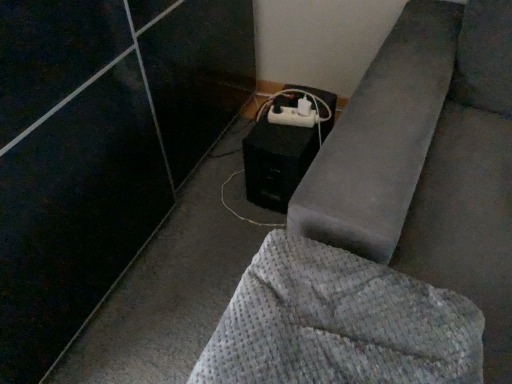
Question: Does waffle-textured gray blanket at lower right have a larger size compared to white plastic extension cord at lower center?

Choices:
 (A) no
 (B) yes

Answer: (B)

Question: From the image's perspective, is waffle-textured gray blanket at lower right under white plastic extension cord at lower center?

Choices:
 (A) yes
 (B) no

Answer: (A)

Question: Is waffle-textured gray blanket at lower right behind white plastic extension cord at lower center?

Choices:
 (A) no
 (B) yes

Answer: (A)

Question: Are waffle-textured gray blanket at lower right and white plastic extension cord at lower center far apart?

Choices:
 (A) yes
 (B) no

Answer: (B)

Question: From the image's perspective, is waffle-textured gray blanket at lower right on top of white plastic extension cord at lower center?

Choices:
 (A) no
 (B) yes

Answer: (A)

Question: Can white plastic extension cord at lower center be found inside waffle-textured gray blanket at lower right?

Choices:
 (A) no
 (B) yes

Answer: (A)

Question: Is waffle-textured gray blanket at lower right closer to camera compared to black matte speaker at lower center?

Choices:
 (A) no
 (B) yes

Answer: (B)

Question: Is waffle-textured gray blanket at lower right positioned far away from black matte speaker at lower center?

Choices:
 (A) yes
 (B) no

Answer: (B)

Question: Is waffle-textured gray blanket at lower right surrounding black matte speaker at lower center?

Choices:
 (A) yes
 (B) no

Answer: (B)

Question: Does waffle-textured gray blanket at lower right have a lesser height compared to black matte speaker at lower center?

Choices:
 (A) yes
 (B) no

Answer: (A)

Question: Does waffle-textured gray blanket at lower right have a smaller size compared to black matte speaker at lower center?

Choices:
 (A) no
 (B) yes

Answer: (B)

Question: Is waffle-textured gray blanket at lower right outside of black matte speaker at lower center?

Choices:
 (A) no
 (B) yes

Answer: (B)

Question: Would you say black matte speaker at lower center contains white plastic extension cord at lower center?

Choices:
 (A) no
 (B) yes

Answer: (B)